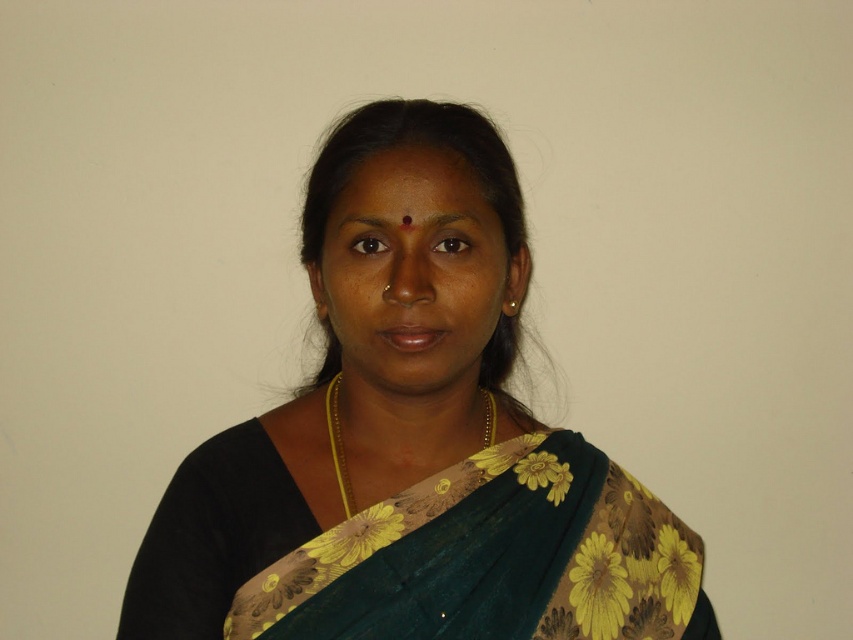
You are a fashion designer trying to create a new collection inspired by traditional Indian attire. You have two options for a saree design to feature in your collection. The first is the green floral saree at center, and the second is the matte green saree at center. Based on the image, which saree would you choose if you want to emphasize the size of the garment in your design?

The green floral saree at center is bigger than the matte green saree at center, so choosing the green floral saree at center would emphasize the size of the garment in the design.

You are a photographer setting up for a portrait. You need to ensure that the matte green saree at center and the gold chain at center are both visible in the frame. Based on their sizes, which object should you focus on to ensure both are in focus?

The matte green saree at center is taller than the gold chain at center, so focusing on the matte green saree at center will ensure both are in focus since it is larger and requires more attention.

You are a fashion designer trying to create a new outfit. You see the matte green saree at center and the gold chain at center in the image. Which one has a greater width?

The matte green saree at center has a greater width than the gold chain at center.